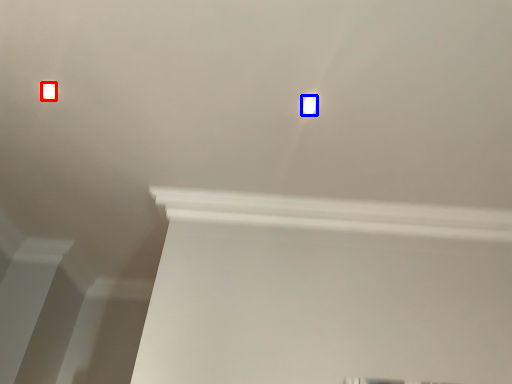
Question: Which object is further to the camera taking this photo, lamp (highlighted by a red box) or lamp (highlighted by a blue box)?

Choices:
 (A) lamp
 (B) lamp

Answer: (A)